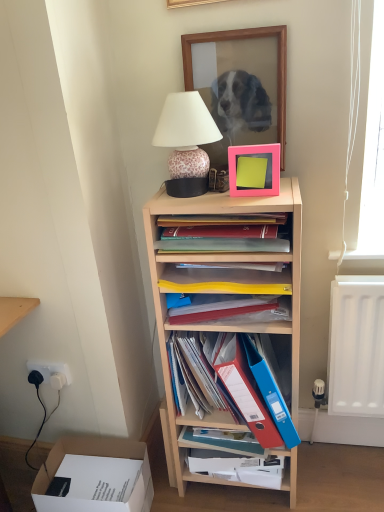
Question: From a real-world perspective, is wooden picture frame at upper center, which appears as the first picture frame when viewed from the back, positioned above or below yellow plastic folder at center, the 2th book when ordered from top to bottom?

Choices:
 (A) above
 (B) below

Answer: (A)

Question: Is wooden picture frame at upper center, which appears as the first picture frame when viewed from the back, inside the boundaries of yellow plastic folder at center, the 2th book when ordered from top to bottom, or outside?

Choices:
 (A) inside
 (B) outside

Answer: (B)

Question: Based on their relative distances, which object is nearer to the leopard print ceramic lamp at upper center?

Choices:
 (A) blue plastic folder at center
 (B) yellow plastic folder at center, acting as the second book starting from the bottom
 (C) white cardboard box at lower left
 (D) light wood shelf at center
 (E) matte pink picture frame at upper center, which is the 2th picture frame in back-to-front order

Answer: (E)

Question: Considering the real-world distances, which object is closest to the matte pink picture frame at upper center, the 2th picture frame when ordered from top to bottom?

Choices:
 (A) leopard print ceramic lamp at upper center
 (B) light wood shelf at center
 (C) matte plastic books at upper center, the first book positioned from the top
 (D) blue plastic folder at center
 (E) yellow plastic folder at center, acting as the second book starting from the bottom

Answer: (C)